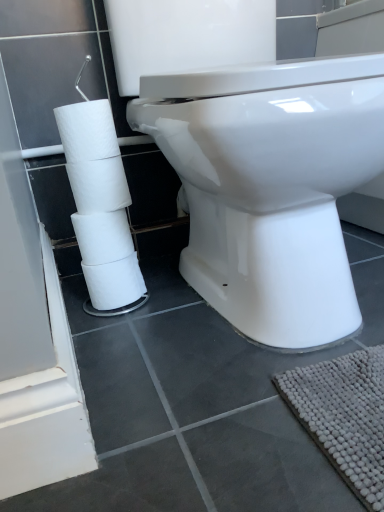
Question: Would you say white matte toilet paper at left is part of white glossy toilet at center's contents?

Choices:
 (A) yes
 (B) no

Answer: (B)

Question: Can you confirm if white glossy toilet at center is thinner than white matte toilet paper at left?

Choices:
 (A) yes
 (B) no

Answer: (B)

Question: From a real-world perspective, does white glossy toilet at center stand above white matte toilet paper at left?

Choices:
 (A) no
 (B) yes

Answer: (B)

Question: Would you consider white glossy toilet at center to be distant from white matte toilet paper at left?

Choices:
 (A) yes
 (B) no

Answer: (B)

Question: Is white glossy toilet at center directly adjacent to white matte toilet paper at left?

Choices:
 (A) no
 (B) yes

Answer: (A)

Question: Is white glossy toilet at center closer to the viewer compared to white matte toilet paper at left?

Choices:
 (A) no
 (B) yes

Answer: (B)

Question: Is white matte toilet paper at left facing towards white glossy toilet at center?

Choices:
 (A) yes
 (B) no

Answer: (B)

Question: Considering the relative sizes of white matte toilet paper at left and white glossy toilet at center in the image provided, is white matte toilet paper at left wider than white glossy toilet at center?

Choices:
 (A) yes
 (B) no

Answer: (B)

Question: Is white matte toilet paper at left turned away from white glossy toilet at center?

Choices:
 (A) yes
 (B) no

Answer: (B)

Question: From a real-world perspective, is white matte toilet paper at left physically above white glossy toilet at center?

Choices:
 (A) no
 (B) yes

Answer: (A)

Question: Can you confirm if white matte toilet paper at left is taller than white glossy toilet at center?

Choices:
 (A) no
 (B) yes

Answer: (A)

Question: Considering the relative sizes of white matte toilet paper at left and white glossy toilet at center in the image provided, is white matte toilet paper at left smaller than white glossy toilet at center?

Choices:
 (A) yes
 (B) no

Answer: (A)

Question: From the image's perspective, is white matte toilet paper at left positioned above or below white glossy toilet at center?

Choices:
 (A) below
 (B) above

Answer: (A)